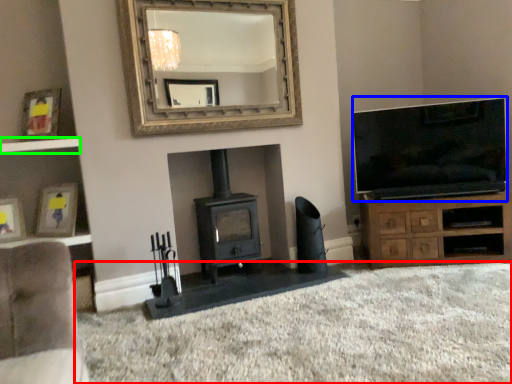
Question: Estimate the real-world distances between objects in this image. Which object is closer to plain (highlighted by a red box), television (highlighted by a blue box) or shelf (highlighted by a green box)?

Choices:
 (A) television
 (B) shelf

Answer: (A)